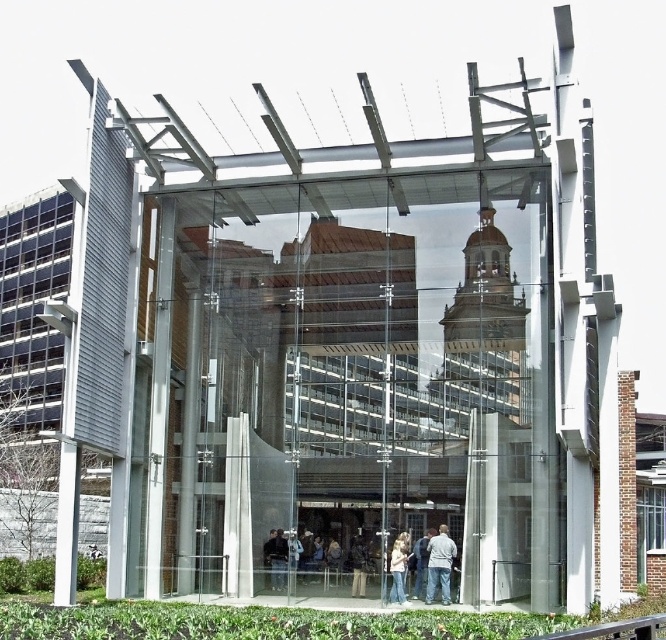
You are standing outside the modern building and want to take a photo of the transparent glass box at center and the light beige sweater at center. Which object will appear larger in your photo?

The transparent glass box at center will appear larger in the photo because it is much taller than the light beige sweater at center.

You are standing outside the modern architectural structure with a glass facade. You see a person wearing a gray cotton shirt at center. If you want to take a photo of the shirt without any reflections from the glass facade, where should you position yourself relative to the shirt?

To avoid reflections, position yourself directly in front of the gray cotton shirt at center, as reflections are strongest at angles away from the perpendicular line to the glass surface. The shirt is located at point (x=440, y=564), so align your camera directly facing that point to minimize reflections.

You are standing in front of the modern architectural structure with a glass facade. You see two points marked on the glass facade. The first point is at coordinates point [452,545] and the second point is at point [400,560]. Which point is closer to you?

Point [452,545] is closer to the camera than point [400,560], so the first point is closer to you.